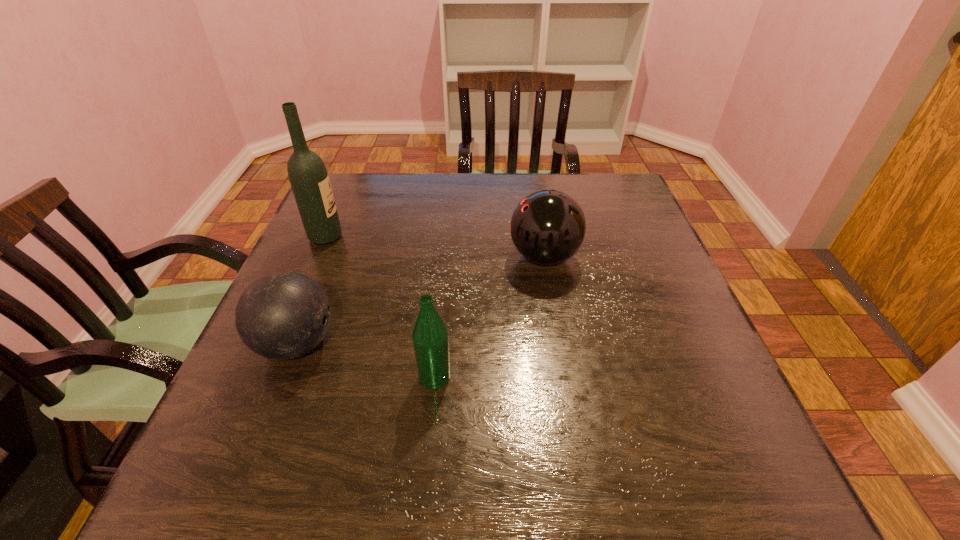
The width and height of the screenshot is (960, 540). Find the location of `unoccupied position between the second object from right to left and the wine bottle`. unoccupied position between the second object from right to left and the wine bottle is located at coordinates (380, 307).

Locate an element on the screen. This screenshot has height=540, width=960. free space between the third object from left to right and the tallest object is located at coordinates (380, 307).

Where is `free spot between the wine bottle and the right bowling ball`? free spot between the wine bottle and the right bowling ball is located at coordinates (435, 247).

Where is `free point between the left bowling ball and the bottle`? Image resolution: width=960 pixels, height=540 pixels. free point between the left bowling ball and the bottle is located at coordinates (366, 360).

Locate an element on the screen. The height and width of the screenshot is (540, 960). free space that is in between the left bowling ball and the third object from left to right is located at coordinates (366, 360).

What are the coordinates of `blank region between the second object from right to left and the wine bottle` in the screenshot? It's located at (380, 307).

Where is `vacant area that lies between the second object from right to left and the left bowling ball`? This screenshot has width=960, height=540. vacant area that lies between the second object from right to left and the left bowling ball is located at coordinates (366, 360).

Image resolution: width=960 pixels, height=540 pixels. In order to click on free space between the bottle and the nearer bowling ball in this screenshot , I will do `click(366, 360)`.

Image resolution: width=960 pixels, height=540 pixels. What are the coordinates of `object that is the closest to the rightmost object` in the screenshot? It's located at (430, 339).

Where is `object that stands as the second closest to the third object from left to right`? object that stands as the second closest to the third object from left to right is located at coordinates (547, 227).